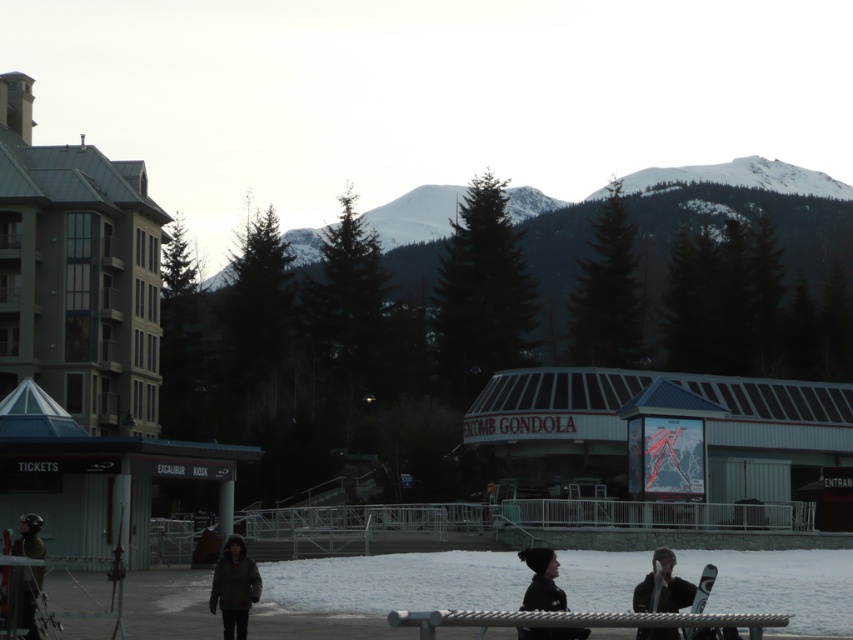
You are a visitor at the ski resort and need to sit down to put on your boots. The silver metallic bench at lower center and the green fabric jacket at lower left are nearby. Which object can you sit on?

The silver metallic bench at lower center can be sat on because it has a greater height compared to the green fabric jacket at lower left, which is likely a person wearing the jacket and not a seating option.